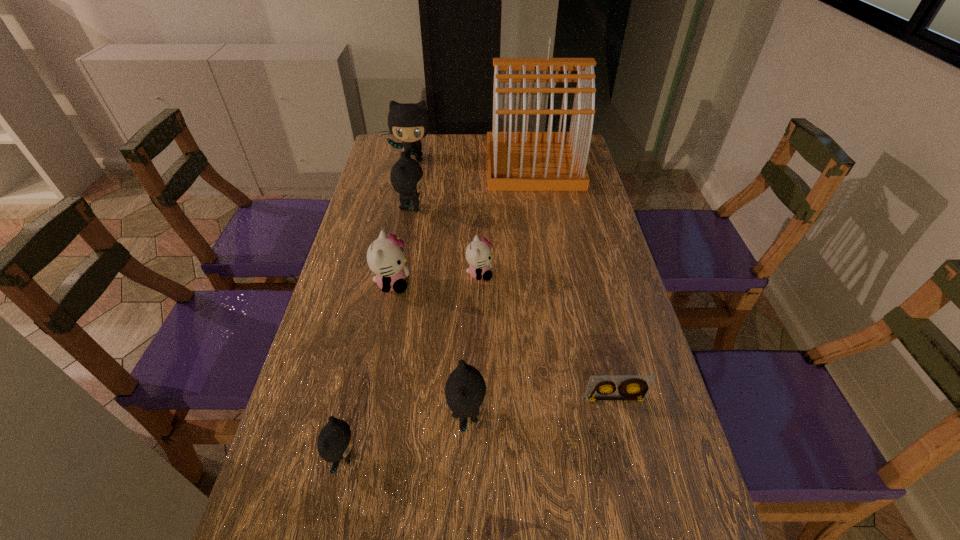
Choose which kitten is the fourth nearest neighbor to the farthest gray kitten. Please provide its 2D coordinates. Your answer should be formatted as a tuple, i.e. [(x, y)], where the tuple contains the x and y coordinates of a point satisfying the conditions above.

[(465, 391)]

Image resolution: width=960 pixels, height=540 pixels. In order to click on the closest kitten to the beige birdcage in this screenshot , I will do `click(408, 122)`.

Select which gray kitten is the third closest to the fifth nearest kitten. Please provide its 2D coordinates. Your answer should be formatted as a tuple, i.e. [(x, y)], where the tuple contains the x and y coordinates of a point satisfying the conditions above.

[(334, 443)]

Locate an element on the screen. the third closest gray kitten relative to the second farthest kitten is located at coordinates (334, 443).

This screenshot has height=540, width=960. Find the location of `blank space that satisfies the following two spatial constraints: 1. on the front-facing side of the tallest kitten; 2. on the front-facing side of the smallest gray kitten`. blank space that satisfies the following two spatial constraints: 1. on the front-facing side of the tallest kitten; 2. on the front-facing side of the smallest gray kitten is located at coordinates (352, 457).